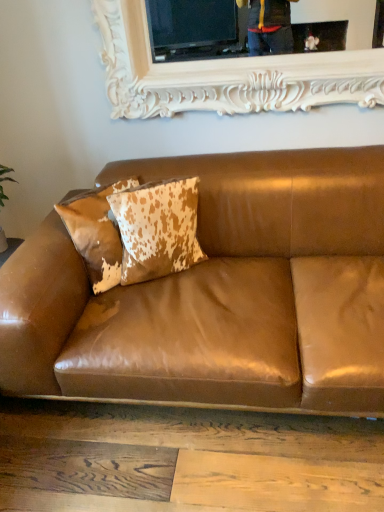
Question: Is brown leather couch at center wider than cowhide pillow at center, which is counted as the first pillow, starting from the left?

Choices:
 (A) yes
 (B) no

Answer: (A)

Question: Is brown leather couch at center shorter than cowhide pillow at center, which is counted as the first pillow, starting from the left?

Choices:
 (A) no
 (B) yes

Answer: (A)

Question: Could you tell me if brown leather couch at center is facing cowhide pillow at center, marked as the 2th pillow in a right-to-left arrangement?

Choices:
 (A) no
 (B) yes

Answer: (B)

Question: From the image's perspective, would you say brown leather couch at center is shown under cowhide pillow at center, marked as the 2th pillow in a right-to-left arrangement?

Choices:
 (A) yes
 (B) no

Answer: (A)

Question: Does brown leather couch at center have a lesser width compared to cowhide pillow at center, which is counted as the first pillow, starting from the left?

Choices:
 (A) yes
 (B) no

Answer: (B)

Question: Is cowhide pillow at center, which is counted as the first pillow, starting from the left, completely or partially inside brown leather couch at center?

Choices:
 (A) no
 (B) yes

Answer: (B)

Question: Can we say white carved wood picture frame at upper center lies outside brown leather couch at center?

Choices:
 (A) no
 (B) yes

Answer: (B)

Question: Does white carved wood picture frame at upper center turn towards brown leather couch at center?

Choices:
 (A) no
 (B) yes

Answer: (A)

Question: Can you confirm if white carved wood picture frame at upper center is positioned to the left of brown leather couch at center?

Choices:
 (A) yes
 (B) no

Answer: (B)

Question: Is white carved wood picture frame at upper center next to brown leather couch at center?

Choices:
 (A) no
 (B) yes

Answer: (A)

Question: Is the position of white carved wood picture frame at upper center more distant than that of brown leather couch at center?

Choices:
 (A) no
 (B) yes

Answer: (B)

Question: Is brown leather couch at center inside white carved wood picture frame at upper center?

Choices:
 (A) yes
 (B) no

Answer: (B)

Question: Is cowhide pillow at upper left, the 1th pillow when ordered from right to left, positioned before cowhide pillow at center, which is counted as the first pillow, starting from the left?

Choices:
 (A) yes
 (B) no

Answer: (A)